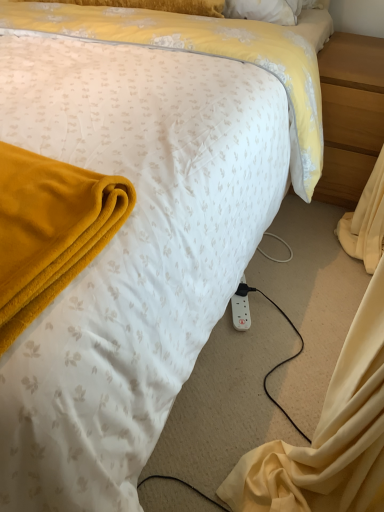
Question: Does point (375, 94) appear closer or farther from the camera than point (236, 293)?

Choices:
 (A) closer
 (B) farther

Answer: (B)

Question: From their relative heights in the image, would you say light brown wood at right is taller or shorter than white plastic power outlet at lower right?

Choices:
 (A) short
 (B) tall

Answer: (B)

Question: Is light brown wood at right inside the boundaries of white plastic power outlet at lower right, or outside?

Choices:
 (A) outside
 (B) inside

Answer: (A)

Question: Is white plastic power outlet at lower right to the left or to the right of light brown wood at right in the image?

Choices:
 (A) right
 (B) left

Answer: (B)

Question: Is white plastic power outlet at lower right wider or thinner than light brown wood at right?

Choices:
 (A) thin
 (B) wide

Answer: (A)

Question: From their relative heights in the image, would you say white plastic power outlet at lower right is taller or shorter than light brown wood at right?

Choices:
 (A) short
 (B) tall

Answer: (A)

Question: From the image's perspective, is white plastic power outlet at lower right positioned above or below light brown wood at right?

Choices:
 (A) above
 (B) below

Answer: (B)